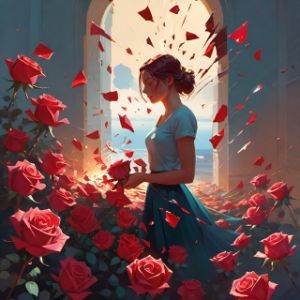
This screenshot has height=300, width=300. I want to click on window, so click(x=202, y=94).